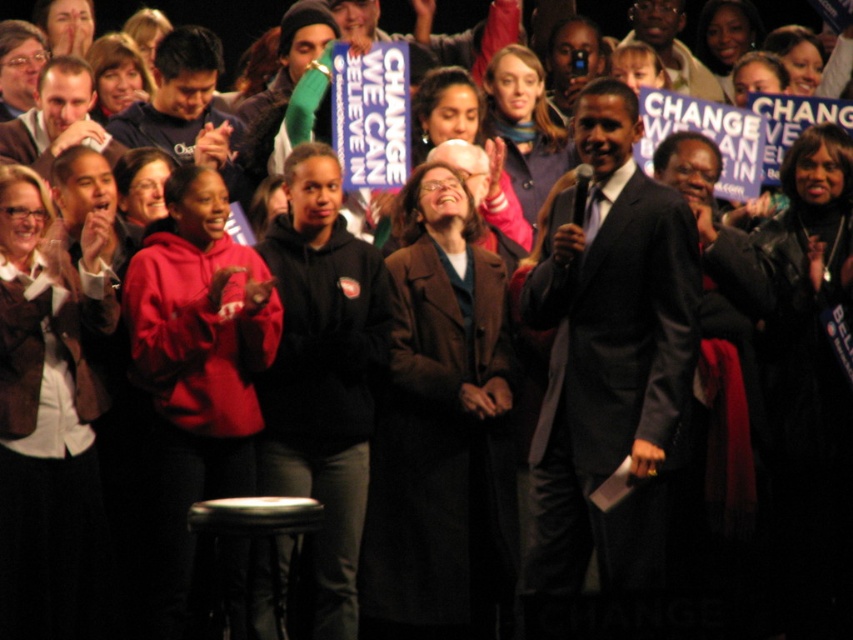
Is red hoodie at center wider than matte brown coat at center?

No, red hoodie at center is not wider than matte brown coat at center.

Which is behind, point (231, 298) or point (552, 124)?

The point (552, 124) is behind.

Identify the location of red hoodie at center. This screenshot has height=640, width=853. (196, 365).

Who is lower down, brown leather jacket at center or matte black hoodie at upper left?

brown leather jacket at center

How much distance is there between brown leather jacket at center and matte black hoodie at upper left?

brown leather jacket at center is 12.20 meters from matte black hoodie at upper left.

Who is more distant from viewer, (41,492) or (106,120)?

Point (106,120)

Locate an element on the screen. Image resolution: width=853 pixels, height=640 pixels. brown leather jacket at center is located at coordinates (49, 420).

Locate an element on the screen. matte brown coat at center is located at coordinates (524, 125).

Is matte brown coat at center positioned in front of black leather stool at lower center?

No, matte brown coat at center is further to the viewer.

Looking at this image, who is more forward, (503, 131) or (260, 522)?

Point (260, 522)

Identify the location of matte brown coat at center. The width and height of the screenshot is (853, 640). (524, 125).